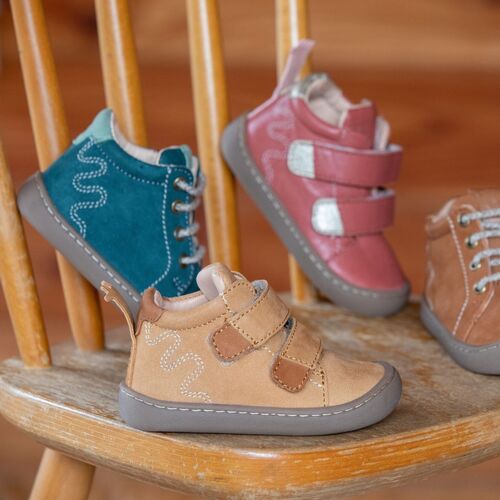
This screenshot has height=500, width=500. Find the location of `chair back dowels`. chair back dowels is located at coordinates (x=294, y=25), (x=205, y=37), (x=120, y=59), (x=41, y=65), (x=10, y=244).